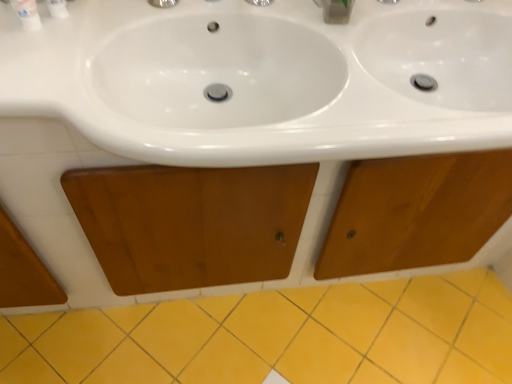
Find the location of a particular element. This screenshot has width=512, height=384. empty space that is ontop of yellow ceramic tile at lower center (from a real-world perspective) is located at coordinates (293, 335).